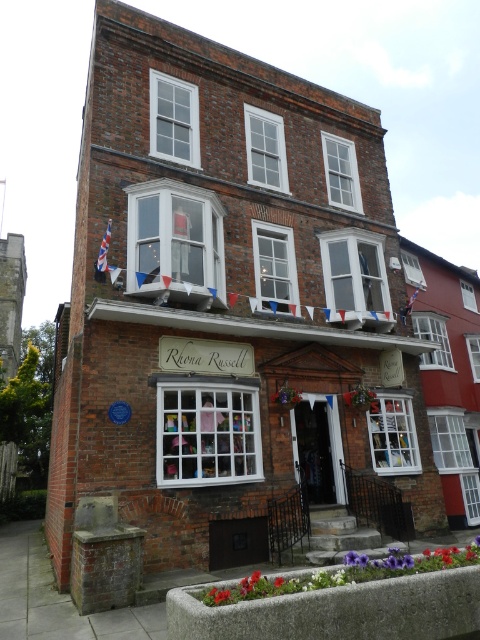
You are a visitor standing in front of the two story brick building. You see the point at coordinates (104,250). What object is located at that point?

The point at coordinates (104,250) corresponds to the union jack fabric flag at upper left.

You are a visitor standing in front of the building and see the union jack fabric flag at upper left and the blue fabric flag at upper center. Which flag is positioned more to the left side of the building?

The union jack fabric flag at upper left is positioned more to the left side of the building than the blue fabric flag at upper center.

Looking at this image, you are standing at the entrance of the two story brick building and see two points marked on the wall. The first point is at coordinate point (99,268) and the second is at coordinate point (405,310). Which point is closer to you?

Point (99,268) is in front of point (405,310), so the first point is closer to you.